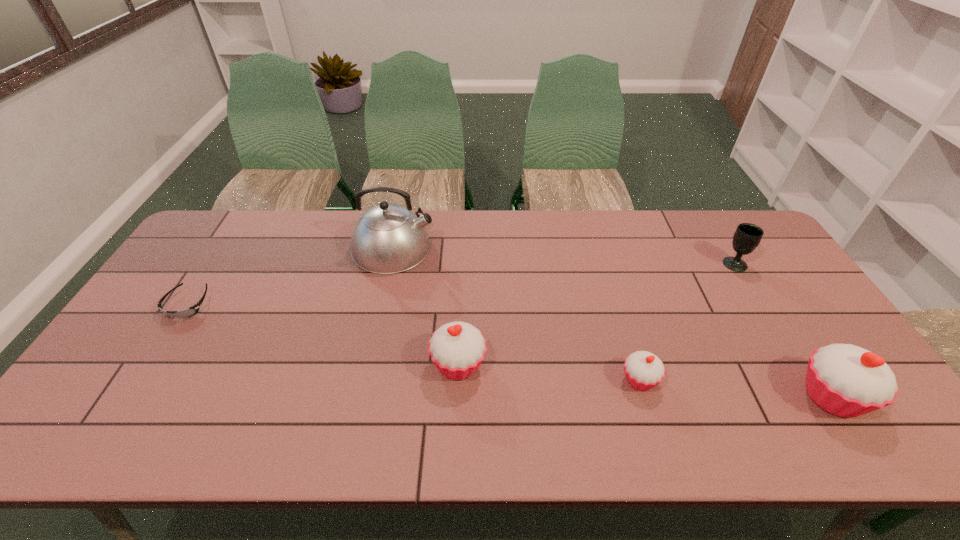
Where is `vacant space that satisfies the following two spatial constraints: 1. from the spout of the tallest object; 2. on the left side of the second shortest cupcake`? This screenshot has width=960, height=540. vacant space that satisfies the following two spatial constraints: 1. from the spout of the tallest object; 2. on the left side of the second shortest cupcake is located at coordinates (368, 365).

Where is `vacant area that satisfies the following two spatial constraints: 1. from the spout of the kettle; 2. on the back side of the fourth object from right to left`? vacant area that satisfies the following two spatial constraints: 1. from the spout of the kettle; 2. on the back side of the fourth object from right to left is located at coordinates (368, 365).

Find the location of `vacant space that satisfies the following two spatial constraints: 1. from the spout of the chalice; 2. on the left side of the second object from left to right`. vacant space that satisfies the following two spatial constraints: 1. from the spout of the chalice; 2. on the left side of the second object from left to right is located at coordinates (390, 264).